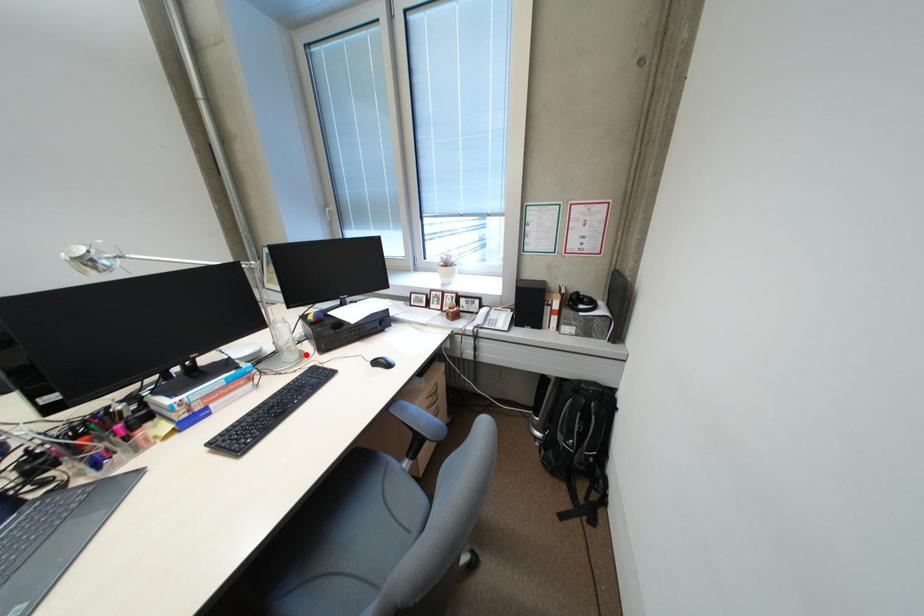
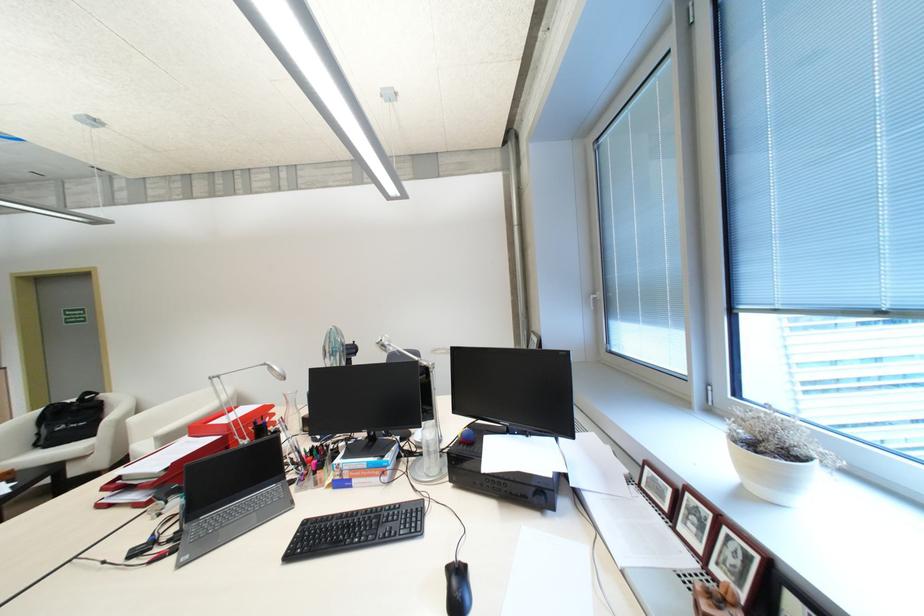
Locate, in the second image, the point that corresponds to the highlighted location in the first image.

(444, 469)